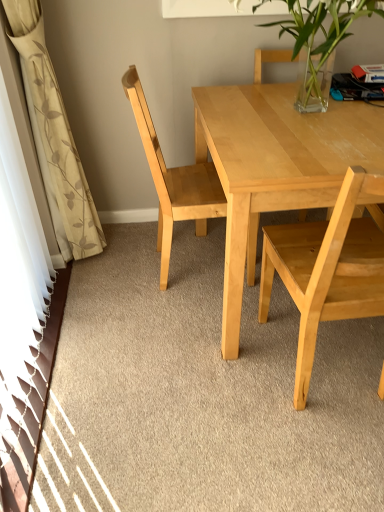
Where is `vacant space that's between white floral fabric curtain at left and light wood chair at center, placed as the 2th chair when sorted from right to left`? vacant space that's between white floral fabric curtain at left and light wood chair at center, placed as the 2th chair when sorted from right to left is located at coordinates (135, 259).